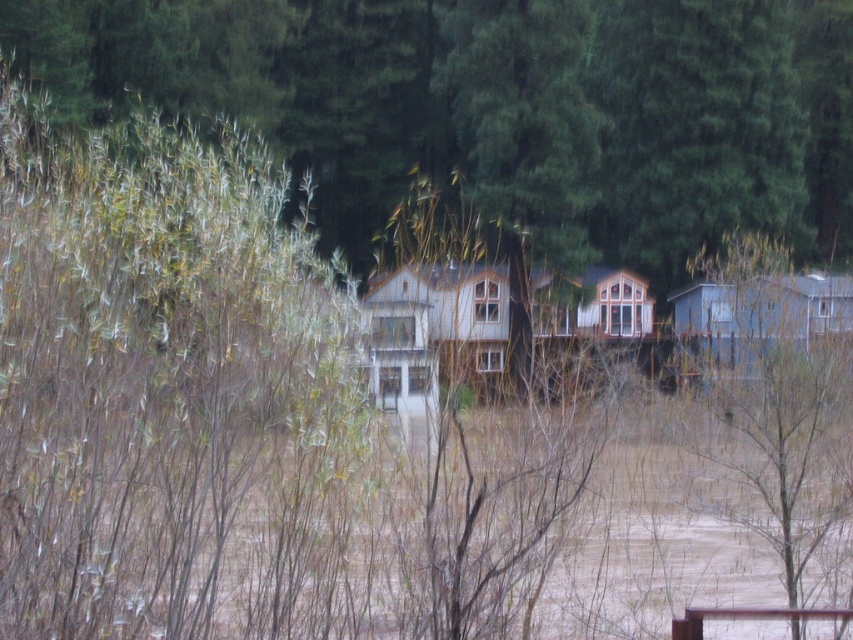
Between green matte tree at right and white wood cabin at center, which one is positioned higher?

green matte tree at right is above.

This screenshot has width=853, height=640. Describe the element at coordinates (780, 410) in the screenshot. I see `green matte tree at right` at that location.

The image size is (853, 640). Identify the location of green matte tree at right. (780, 410).

Which is in front, point (779, 419) or point (814, 314)?

Positioned in front is point (779, 419).

Which is more to the left, green matte tree at right or blue wood cabin at right?

blue wood cabin at right is more to the left.

Which is behind, point (788, 611) or point (817, 301)?

The point (817, 301) is behind.

Locate an element on the screen. Image resolution: width=853 pixels, height=640 pixels. green matte tree at right is located at coordinates (780, 410).

Between white wood cabin at center and blue wood cabin at right, which one has more height?

white wood cabin at center is taller.

Is white wood cabin at center positioned behind blue wood cabin at right?

No, it is not.

Which is in front, point (567, 304) or point (700, 296)?

Point (700, 296)

This screenshot has width=853, height=640. What are the coordinates of `white wood cabin at center` in the screenshot? It's located at (432, 323).